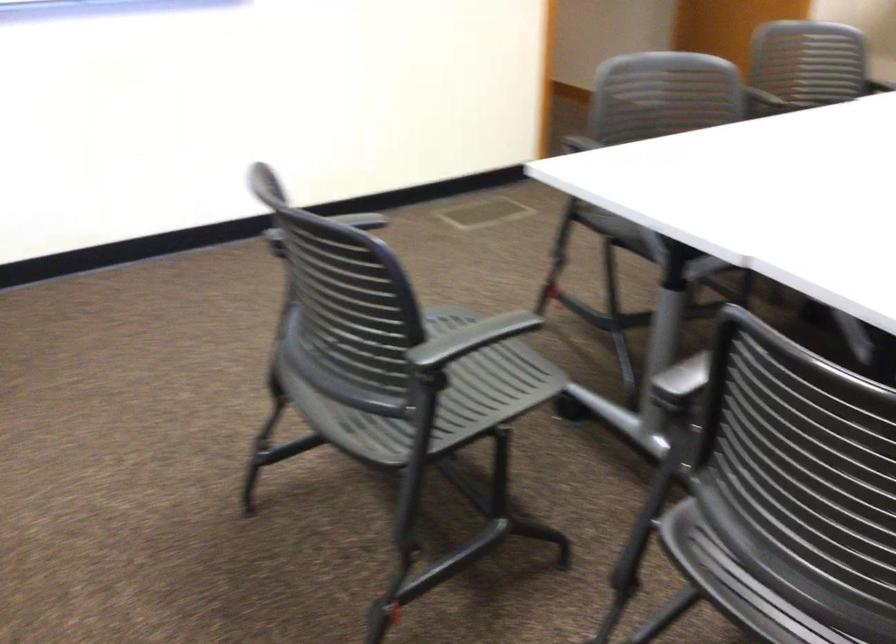
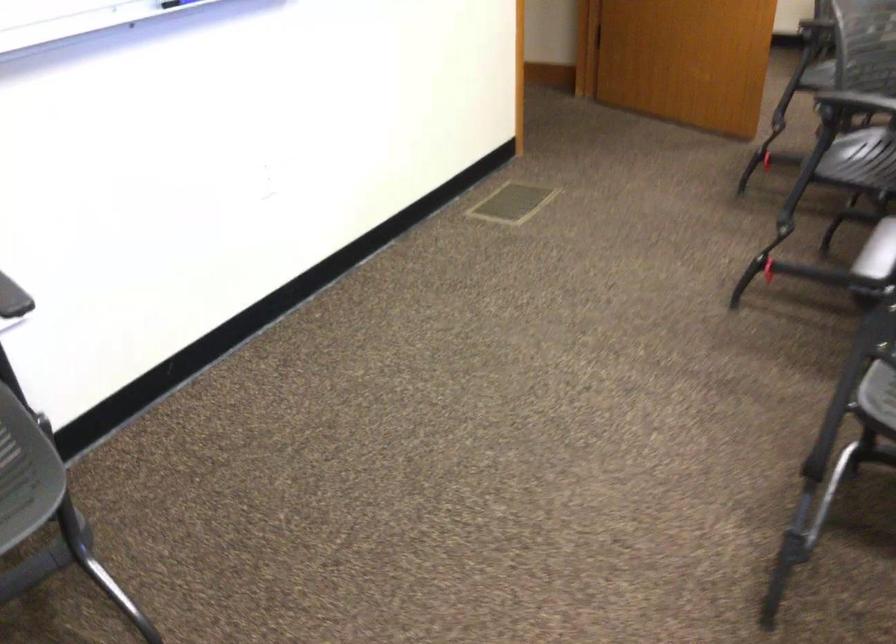
Consider the image. What movement of the cameraman would produce the second image?

The cameraman moved toward left, forward.